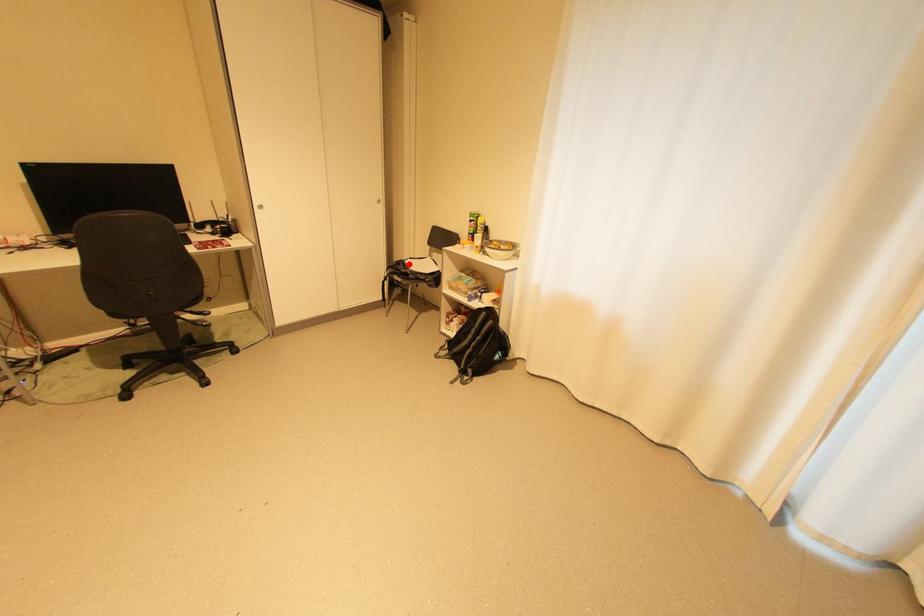
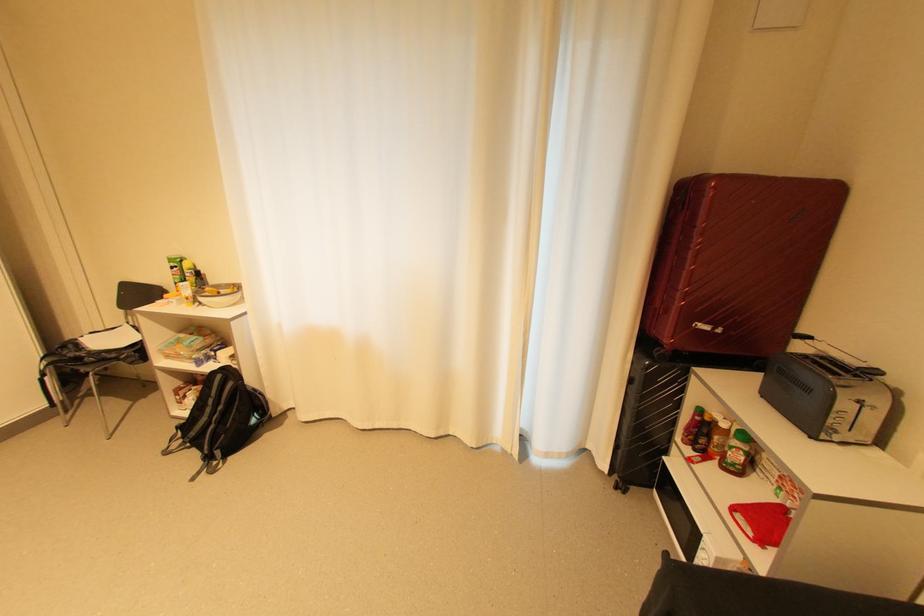
In the second image, find the point that corresponds to the highlighted location in the first image.

(79, 346)